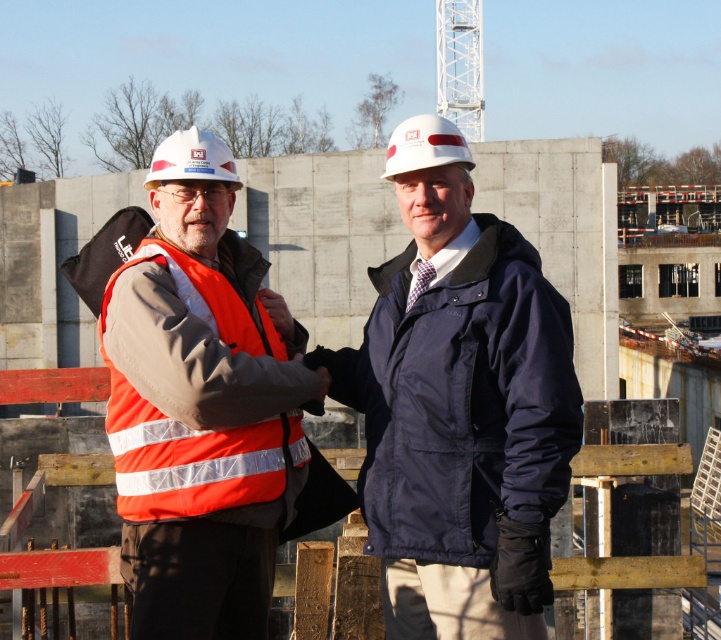
Question: Which of the following is the farthest from the observer?

Choices:
 (A) white hard hat at center
 (B) navy blue jacket at center

Answer: (A)

Question: Which point appears closest to the camera in this image?

Choices:
 (A) (154, 168)
 (B) (424, 372)
 (C) (415, 145)

Answer: (B)

Question: Is navy blue jacket at center further to the viewer compared to white matte hard hat at center?

Choices:
 (A) no
 (B) yes

Answer: (A)

Question: Is navy blue jacket at center wider than white hard hat at center?

Choices:
 (A) no
 (B) yes

Answer: (A)

Question: Which object is closer to the camera taking this photo?

Choices:
 (A) white matte hard hat at center
 (B) white hard hat at center
 (C) reflective orange safety vest at left

Answer: (C)

Question: Can you confirm if navy blue jacket at center is positioned to the right of reflective orange safety vest at left?

Choices:
 (A) no
 (B) yes

Answer: (B)